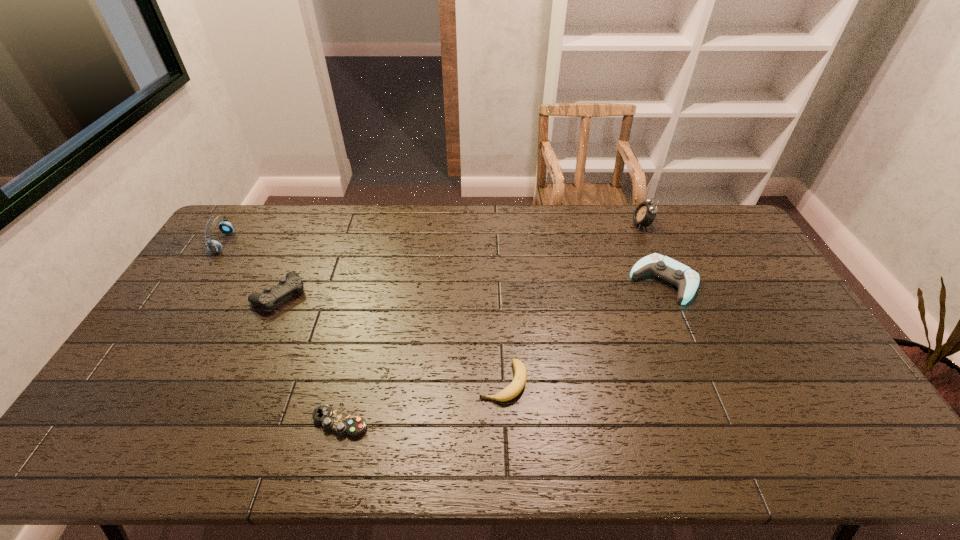
Image resolution: width=960 pixels, height=540 pixels. Find the location of `object present at the far left corner`. object present at the far left corner is located at coordinates (214, 246).

This screenshot has height=540, width=960. In the image, there is a desktop. In order to click on vacant region at the far edge in this screenshot , I will do `click(503, 221)`.

The image size is (960, 540). In the image, there is a desktop. Identify the location of vacant region at the near edge. (442, 460).

In the image, there is a desktop. What are the coordinates of `vacant space at the left edge` in the screenshot? It's located at (132, 382).

What are the coordinates of `free spot at the right edge of the desktop` in the screenshot? It's located at (831, 396).

The image size is (960, 540). What are the coordinates of `free space at the far right corner of the desktop` in the screenshot? It's located at (692, 206).

Where is `free spot between the headset and the second control from right to left`? The width and height of the screenshot is (960, 540). free spot between the headset and the second control from right to left is located at coordinates (282, 333).

Identify the location of free space between the banana and the shortest object. (421, 402).

Locate an element on the screen. The height and width of the screenshot is (540, 960). blank region between the rightmost control and the leftmost object is located at coordinates (444, 262).

The image size is (960, 540). What are the coordinates of `free space between the alarm clock and the shortest object` in the screenshot? It's located at (491, 323).